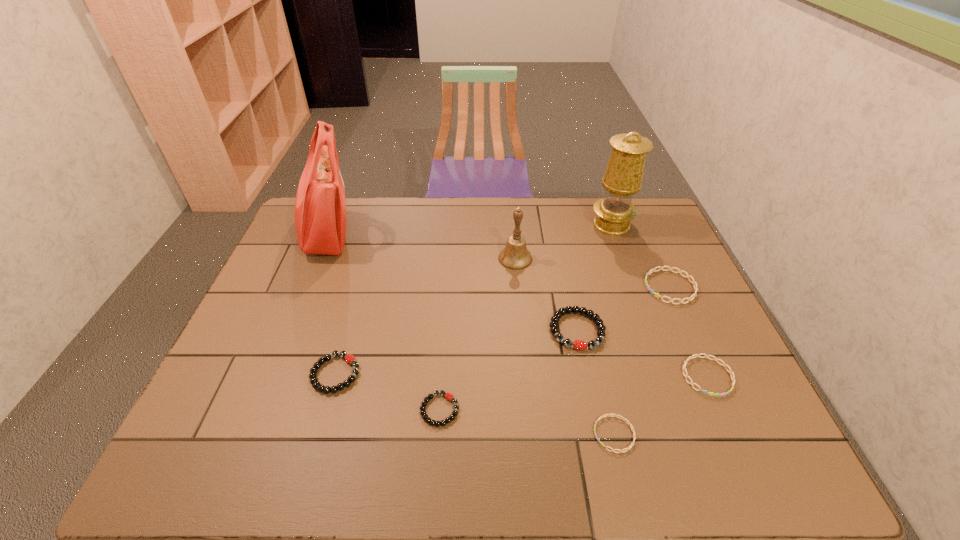
You are a GUI agent. You are given a task and a screenshot of the screen. Output one action in this format:
    pyautogui.click(x=<x>, y=<y>)
    Task: Click on the free spot between the bell and the leftmost blue bracelet
    The image size is (960, 540).
    Given the screenshot: What is the action you would take?
    564,346

Find the location of a particular element. object that is the fifth closest to the red handbag is located at coordinates (623, 176).

You are a GUI agent. You are given a task and a screenshot of the screen. Output one action in this format:
    pyautogui.click(x=<x>, y=<y>)
    Task: Click on the object that stands as the closest to the oil lamp
    The image size is (960, 540).
    Given the screenshot: What is the action you would take?
    pyautogui.click(x=693, y=282)

The height and width of the screenshot is (540, 960). Identify the location of bracelet that can be found as the closest to the second nearest blue bracelet. (580, 345).

Image resolution: width=960 pixels, height=540 pixels. In order to click on bracelet identified as the fifth closest to the second black bracelet from right to left in this screenshot , I will do `click(693, 282)`.

Identify which black bracelet is located as the nearest to the second black bracelet from left to right. Please provide its 2D coordinates. Your answer should be formatted as a tuple, i.e. [(x, y)], where the tuple contains the x and y coordinates of a point satisfying the conditions above.

[(349, 358)]

Identify the location of black bracelet that is the closest to the sixth object from right to left. (580, 345).

You are a GUI agent. You are given a task and a screenshot of the screen. Output one action in this format:
    pyautogui.click(x=<x>, y=<y>)
    Task: Click on the blue bracelet that is the second nearest to the nearest blue bracelet
    This screenshot has width=960, height=540.
    Given the screenshot: What is the action you would take?
    pyautogui.click(x=693, y=282)

The image size is (960, 540). Find the location of `blue bracelet that can be found as the second closest to the farthest blue bracelet`. blue bracelet that can be found as the second closest to the farthest blue bracelet is located at coordinates (632, 444).

The image size is (960, 540). What are the coordinates of `free space that satisfies the following two spatial constraints: 1. on the front-facing side of the smallest black bracelet; 2. on the right side of the handbag` in the screenshot? It's located at (254, 410).